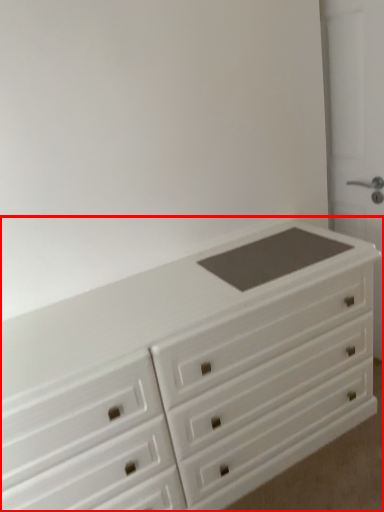
Question: From the image's perspective, what is the correct spatial relationship of chest of drawers (annotated by the red box) in relation to screen door?

Choices:
 (A) below
 (B) above

Answer: (A)